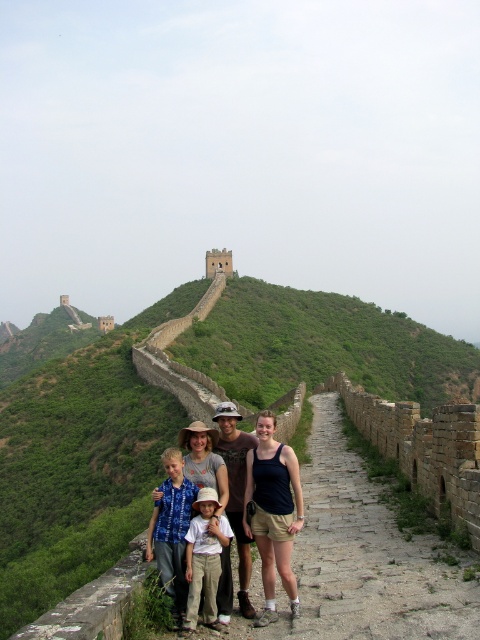
Question: Which object is closer to the camera taking this photo?

Choices:
 (A) blue tie-dye shirt at center
 (B) light brown cotton shorts at center

Answer: (B)

Question: Is blue tie-dye shirt at center positioned before light brown cotton shorts at center?

Choices:
 (A) yes
 (B) no

Answer: (B)

Question: Which of the following is the closest to the observer?

Choices:
 (A) (285, 529)
 (B) (231, 513)
 (C) (213, 496)

Answer: (A)

Question: Is blue tie-dye shirt at center further to the viewer compared to light brown cotton shorts at center?

Choices:
 (A) yes
 (B) no

Answer: (A)

Question: Among these objects, which one is farthest from the camera?

Choices:
 (A) dark brown leather boots at center
 (B) light brown cotton shorts at center

Answer: (A)

Question: Where is blue tie-dye shirt at center located in relation to light brown cotton shorts at center in the image?

Choices:
 (A) below
 (B) above

Answer: (B)